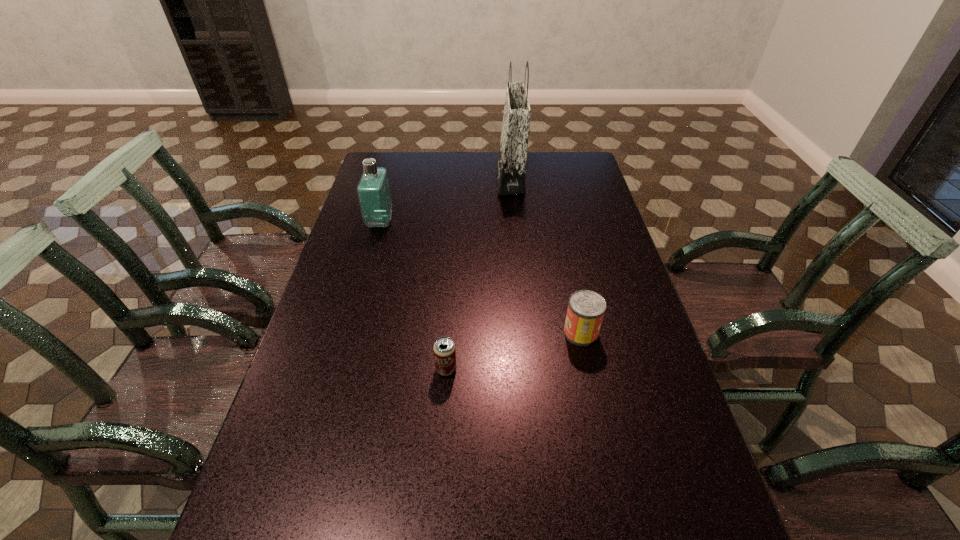
Identify the location of free space located 0.370m on the front of the farthest object with the design. (402, 179).

The image size is (960, 540). I want to click on vacant space located on the front label of the third shortest object, so click(x=427, y=222).

The height and width of the screenshot is (540, 960). Find the location of `free spot located 0.180m on the front of the rightmost object`. free spot located 0.180m on the front of the rightmost object is located at coordinates (597, 409).

This screenshot has width=960, height=540. Identify the location of free space located 0.300m on the right of the shortest object. (580, 369).

Where is `object located in the far edge section of the desktop`? object located in the far edge section of the desktop is located at coordinates (511, 161).

This screenshot has height=540, width=960. What are the coordinates of `object positioned at the left edge` in the screenshot? It's located at (373, 189).

Locate an element on the screen. The width and height of the screenshot is (960, 540). object located in the right edge section of the desktop is located at coordinates (586, 308).

What are the coordinates of `vacant space at the far edge of the desktop` in the screenshot? It's located at coord(427,153).

The width and height of the screenshot is (960, 540). I want to click on vacant space at the left edge of the desktop, so click(x=270, y=446).

What are the coordinates of `blank area at the right edge` in the screenshot? It's located at (613, 352).